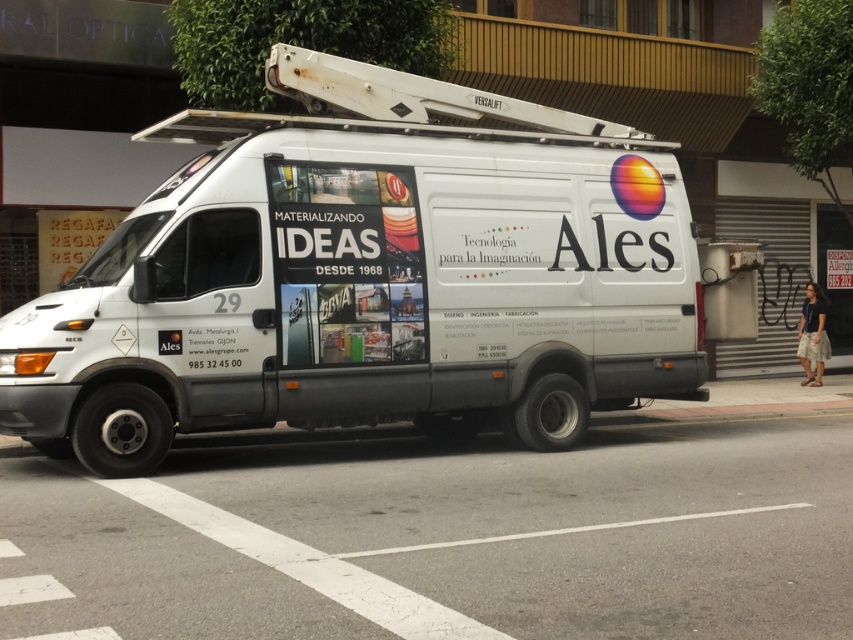
Question: Is white matte van at center below matte paper poster at center?

Choices:
 (A) yes
 (B) no

Answer: (A)

Question: Which of the following is the farthest from the observer?

Choices:
 (A) matte paper poster at center
 (B) white matte van at center

Answer: (B)

Question: Does white matte van at center appear under matte paper poster at center?

Choices:
 (A) yes
 (B) no

Answer: (A)

Question: Among these points, which one is farthest from the camera?

Choices:
 (A) (376, 328)
 (B) (409, 237)

Answer: (B)

Question: Is white matte van at center above matte paper poster at center?

Choices:
 (A) yes
 (B) no

Answer: (B)